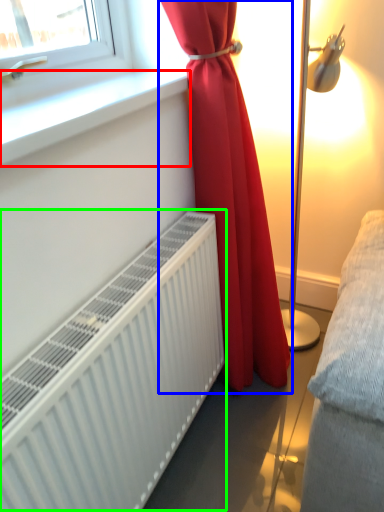
Question: Which is nearer to the window sill (highlighted by a red box)? curtain (highlighted by a blue box) or radiator (highlighted by a green box).

Choices:
 (A) curtain
 (B) radiator

Answer: (A)